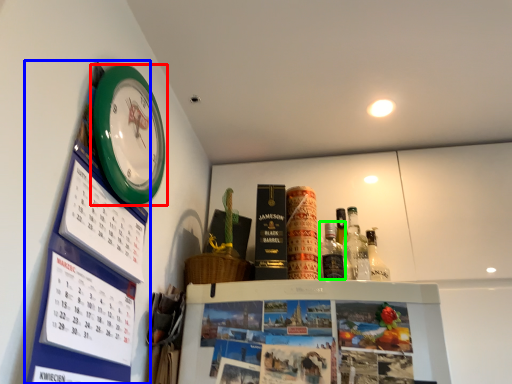
Question: Which is farther away from wall clock (highlighted by a red box)? bulletin board (highlighted by a blue box) or bottle (highlighted by a green box)?

Choices:
 (A) bulletin board
 (B) bottle

Answer: (B)